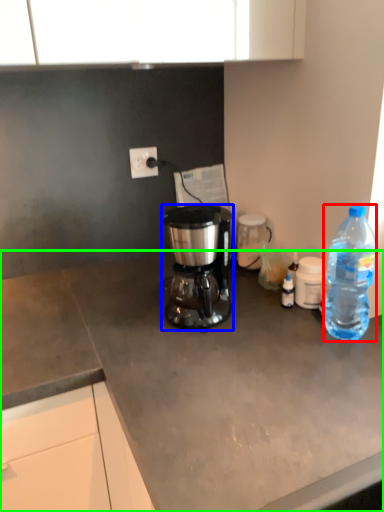
Question: Estimate the real-world distances between objects in this image. Which object is closer to bottle (highlighted by a red box), coffee maker (highlighted by a blue box) or desk (highlighted by a green box)?

Choices:
 (A) coffee maker
 (B) desk

Answer: (A)